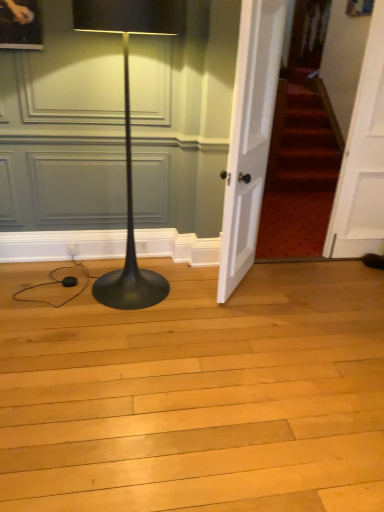
Question: From the image's perspective, is white wooden door at right, the second door viewed from the left, located above black glossy floor lamp at left?

Choices:
 (A) yes
 (B) no

Answer: (A)

Question: From a real-world perspective, is white wooden door at right, the 1th door in the right-to-left sequence, on black glossy floor lamp at left?

Choices:
 (A) no
 (B) yes

Answer: (B)

Question: From a real-world perspective, is white wooden door at right, the 1th door in the right-to-left sequence, beneath black glossy floor lamp at left?

Choices:
 (A) no
 (B) yes

Answer: (A)

Question: Can you confirm if white wooden door at right, the 1th door in the right-to-left sequence, is smaller than black glossy floor lamp at left?

Choices:
 (A) no
 (B) yes

Answer: (B)

Question: From the image's perspective, is white wooden door at right, the 1th door in the right-to-left sequence, under black glossy floor lamp at left?

Choices:
 (A) yes
 (B) no

Answer: (B)

Question: Is white wooden door at right, the 1th door in the right-to-left sequence, shorter than black glossy floor lamp at left?

Choices:
 (A) no
 (B) yes

Answer: (A)

Question: Would you consider white wooden door at center, the first door in the left-to-right sequence, to be distant from white wooden door at right, the 1th door in the right-to-left sequence?

Choices:
 (A) yes
 (B) no

Answer: (B)

Question: Would you say white wooden door at right, the 1th door in the right-to-left sequence, is part of white wooden door at center, the first door in the left-to-right sequence,'s contents?

Choices:
 (A) no
 (B) yes

Answer: (A)

Question: From a real-world perspective, is white wooden door at center, the first door in the left-to-right sequence, physically above white wooden door at right, the 1th door in the right-to-left sequence?

Choices:
 (A) yes
 (B) no

Answer: (B)

Question: Is white wooden door at center, the first door in the left-to-right sequence, at the left side of white wooden door at right, the second door viewed from the left?

Choices:
 (A) no
 (B) yes

Answer: (B)

Question: Is white wooden door at center, the second door when ordered from right to left, wider than white wooden door at right, the 1th door in the right-to-left sequence?

Choices:
 (A) yes
 (B) no

Answer: (A)

Question: Can you confirm if white wooden door at center, the first door in the left-to-right sequence, is taller than white wooden door at right, the 1th door in the right-to-left sequence?

Choices:
 (A) yes
 (B) no

Answer: (B)

Question: Is black glossy floor lamp at left far from white wooden door at right, the 1th door in the right-to-left sequence?

Choices:
 (A) yes
 (B) no

Answer: (A)